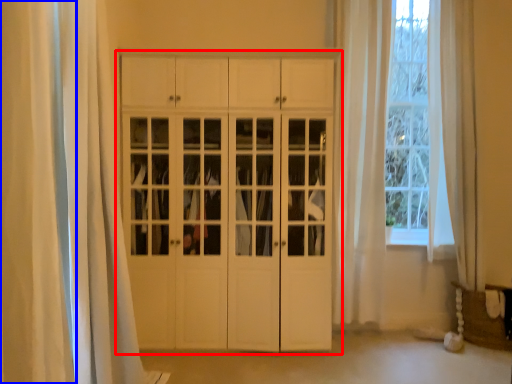
Question: Which of the following is the closest to the observer, cupboard (highlighted by a red box) or curtain (highlighted by a blue box)?

Choices:
 (A) cupboard
 (B) curtain

Answer: (B)